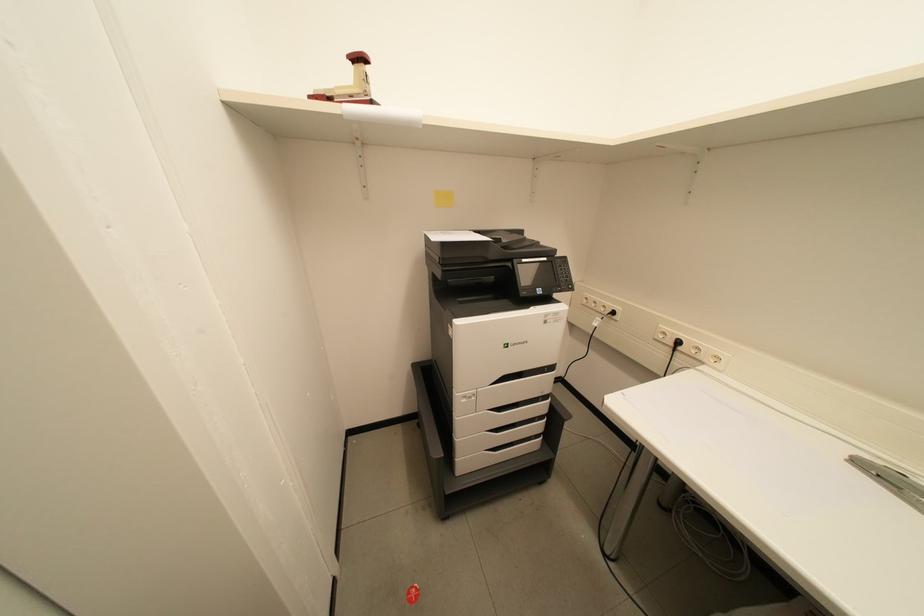
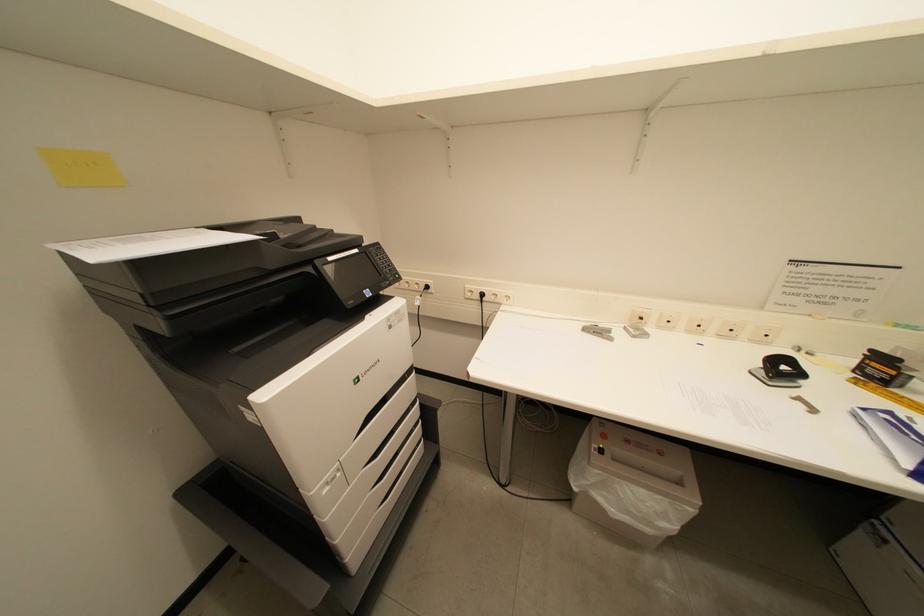
Question: How did the camera likely rotate?

Choices:
 (A) Left
 (B) Right
 (C) Up
 (D) Down

Answer: (B)